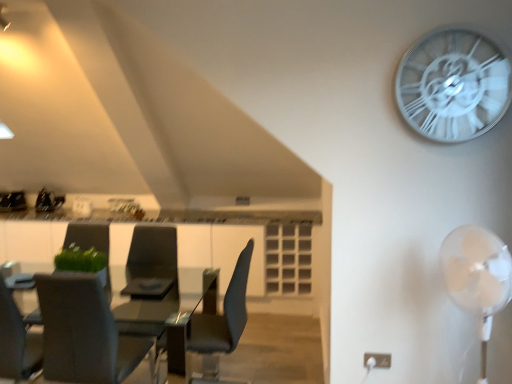
Question: From the image's perspective, is matte black chair at center, marked as the second chair in a left-to-right arrangement, below white metallic clock at upper right?

Choices:
 (A) no
 (B) yes

Answer: (B)

Question: Can you confirm if matte black chair at center, arranged as the first chair when viewed from the right, is thinner than white metallic clock at upper right?

Choices:
 (A) yes
 (B) no

Answer: (B)

Question: Can you confirm if matte black chair at center, arranged as the first chair when viewed from the right, is bigger than white metallic clock at upper right?

Choices:
 (A) yes
 (B) no

Answer: (A)

Question: Is matte black chair at center, marked as the second chair in a left-to-right arrangement, wider than white metallic clock at upper right?

Choices:
 (A) yes
 (B) no

Answer: (A)

Question: Can you confirm if matte black chair at center, marked as the second chair in a left-to-right arrangement, is shorter than white metallic clock at upper right?

Choices:
 (A) no
 (B) yes

Answer: (A)

Question: Relative to green fabric armchair at left, which appears as the 2th armchair when viewed from the right, is white plastic fan at right in front or behind?

Choices:
 (A) behind
 (B) front

Answer: (B)

Question: Looking at the image, does white plastic fan at right seem bigger or smaller compared to green fabric armchair at left, the first armchair from the left?

Choices:
 (A) big
 (B) small

Answer: (A)

Question: From a real-world perspective, is white plastic fan at right above or below green fabric armchair at left, the first armchair from the left?

Choices:
 (A) above
 (B) below

Answer: (B)

Question: From their relative heights in the image, would you say white plastic fan at right is taller or shorter than green fabric armchair at left, the first armchair from the left?

Choices:
 (A) tall
 (B) short

Answer: (A)

Question: Is green fabric armchair at left, which appears as the 2th armchair when viewed from the right, in front of or behind white metallic clock at upper right in the image?

Choices:
 (A) behind
 (B) front

Answer: (A)

Question: Considering the positions of green fabric armchair at left, the first armchair from the left, and white metallic clock at upper right in the image, is green fabric armchair at left, the first armchair from the left, wider or thinner than white metallic clock at upper right?

Choices:
 (A) thin
 (B) wide

Answer: (B)

Question: From a real-world perspective, is green fabric armchair at left, the first armchair from the left, positioned above or below white metallic clock at upper right?

Choices:
 (A) above
 (B) below

Answer: (B)

Question: Based on their sizes in the image, would you say green fabric armchair at left, the first armchair from the left, is bigger or smaller than white metallic clock at upper right?

Choices:
 (A) big
 (B) small

Answer: (B)

Question: Is white metallic clock at upper right situated inside matte black chair at center, arranged as the first chair when viewed from the right, or outside?

Choices:
 (A) inside
 (B) outside

Answer: (B)

Question: Does point (410, 71) appear closer or farther from the camera than point (237, 301)?

Choices:
 (A) farther
 (B) closer

Answer: (B)